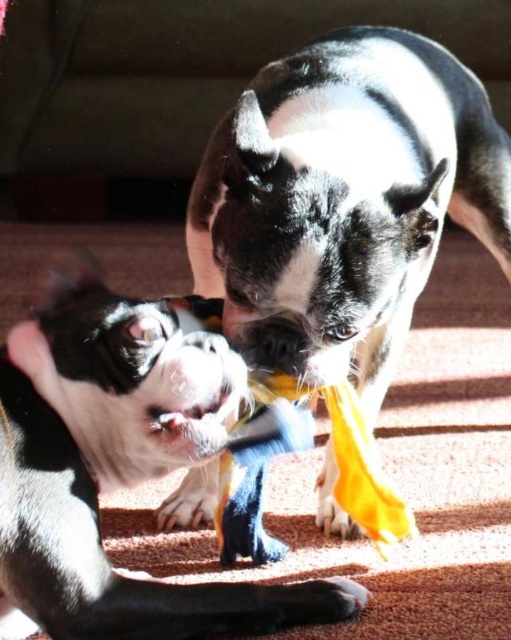
You are a dog trainer observing the two dogs in the image. The black matte dog at center and the fuzzy white fur at center are playing. Which dog is taller?

The black matte dog at center is much taller than the fuzzy white fur at center.

You are a dog owner trying to identify which dog is bigger in the image. You see both the black and white fur at center and the black matte dog at center. Which one is bigger?

The black and white fur at center is larger in size than the black matte dog at center.

You are a dog trainer observing two Boston Terriers playing with a toy. You notice the black and white fur at center and the fuzzy white fur at center. Which dog is closer to the toy?

The black and white fur at center is closer to the toy since it is only 18.93 inches away from the fuzzy white fur at center, which belongs to the other dog.